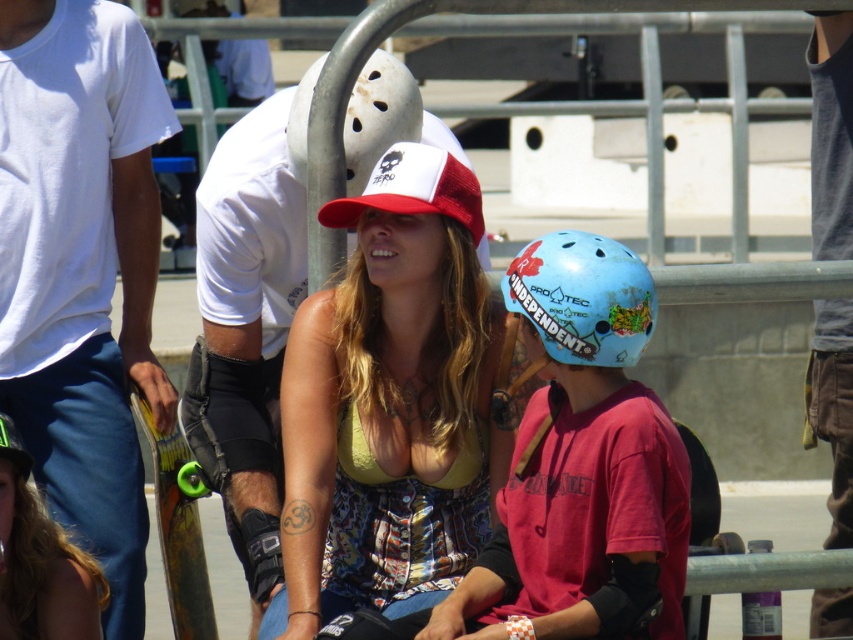
Which is above, blue matte helmet at center or green rubber skateboard at lower left?

Positioned higher is blue matte helmet at center.

Who is more distant from viewer, (x=630, y=253) or (x=160, y=449)?

The point (x=160, y=449) is more distant.

The image size is (853, 640). In order to click on blue matte helmet at center in this screenshot , I will do `click(582, 465)`.

Is the position of white cotton t-shirt at left less distant than that of green rubber skateboard at lower left?

Yes.

Is white cotton t-shirt at left to the right of green rubber skateboard at lower left from the viewer's perspective?

In fact, white cotton t-shirt at left is to the left of green rubber skateboard at lower left.

This screenshot has width=853, height=640. What do you see at coordinates (82, 269) in the screenshot?
I see `white cotton t-shirt at left` at bounding box center [82, 269].

This screenshot has width=853, height=640. I want to click on white cotton t-shirt at left, so click(x=82, y=269).

Describe the element at coordinates (378, 115) in the screenshot. Image resolution: width=853 pixels, height=640 pixels. I see `white matte helmet at upper center` at that location.

Which is more to the right, white matte helmet at upper center or white mesh baseball cap at center?

Positioned to the right is white mesh baseball cap at center.

What are the coordinates of `white matte helmet at upper center` in the screenshot? It's located at (x=378, y=115).

The image size is (853, 640). I want to click on white matte helmet at upper center, so click(x=378, y=115).